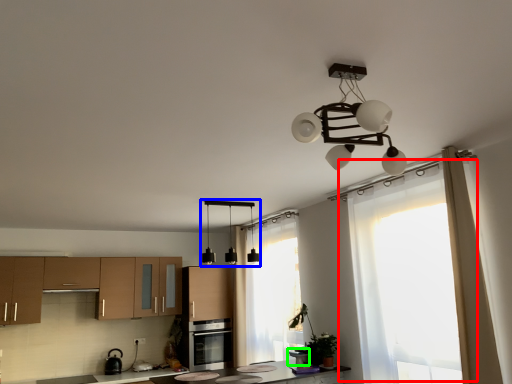
Question: Based on their relative distances, which object is nearer to window (highlighted by a red box)? Choose from lamp (highlighted by a blue box) and appliance (highlighted by a green box).

Choices:
 (A) lamp
 (B) appliance

Answer: (B)